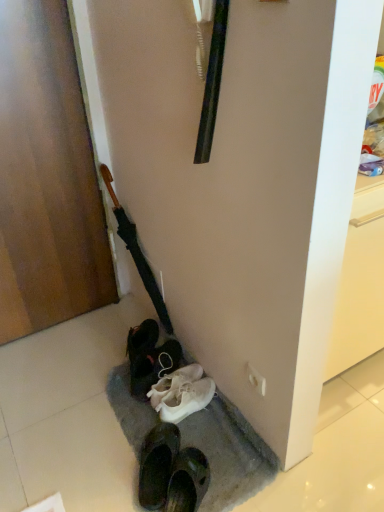
What do you see at coordinates (46, 177) in the screenshot? I see `wooden door at left` at bounding box center [46, 177].

Measure the distance between wooden door at left and camera.

wooden door at left is 4.58 feet away from camera.

The height and width of the screenshot is (512, 384). Identify the location of black matte umbrella at left. (136, 252).

Identify the location of umbrella behind the wooden door at left. Image resolution: width=384 pixels, height=512 pixels. (136, 252).

Is wooden door at left completely or partially outside of black matte umbrella at left?

Yes.

Who is smaller, wooden door at left or black matte umbrella at left?

black matte umbrella at left.

Can you confirm if black matte umbrella at left is positioned to the right of white matte sneakers at lower center?

In fact, black matte umbrella at left is to the left of white matte sneakers at lower center.

From a real-world perspective, between black matte umbrella at left and white matte sneakers at lower center, who is vertically higher?

In real-world perspective, black matte umbrella at left is above.

Can you tell me how much black matte umbrella at left and white matte sneakers at lower center differ in facing direction?

0.00229 degrees separate the facing orientations of black matte umbrella at left and white matte sneakers at lower center.

Considering the points (113, 195) and (166, 369), which point is behind, point (113, 195) or point (166, 369)?

The point (113, 195) is behind.

Based on the photo, considering the sizes of objects wooden door at left and white matte sneakers at lower center in the image provided, who is taller, wooden door at left or white matte sneakers at lower center?

wooden door at left.

Does point (16, 124) come in front of point (152, 358)?

Yes, it is in front of point (152, 358).

Are wooden door at left and white matte sneakers at lower center far apart?

Actually, wooden door at left and white matte sneakers at lower center are a little close together.

From the image's perspective, is wooden door at left on top of white matte sneakers at lower center?

Yes, from the image's perspective, wooden door at left is on top of white matte sneakers at lower center.

Is point (140, 274) farther from camera compared to point (45, 215)?

Yes, it is.

From a real-world perspective, between black matte umbrella at left and wooden door at left, who is vertically higher?

From a 3D spatial view, wooden door at left is above.

Is black matte umbrella at left touching wooden door at left?

No, black matte umbrella at left is not next to wooden door at left.

Between black matte umbrella at left and wooden door at left, which one appears on the left side from the viewer's perspective?

Positioned to the left is wooden door at left.

Which of these two, white matte sneakers at lower center or black matte umbrella at left, is wider?

white matte sneakers at lower center.

Is white matte sneakers at lower center inside the boundaries of black matte umbrella at left, or outside?

white matte sneakers at lower center is outside black matte umbrella at left.

Considering the relative sizes of white matte sneakers at lower center and black matte umbrella at left in the image provided, is white matte sneakers at lower center taller than black matte umbrella at left?

In fact, white matte sneakers at lower center may be shorter than black matte umbrella at left.

Is white matte sneakers at lower center positioned far away from black matte umbrella at left?

No, white matte sneakers at lower center is in close proximity to black matte umbrella at left.

The image size is (384, 512). What are the coordinates of `door on the left side of white matte sneakers at lower center` in the screenshot? It's located at (46, 177).

Considering the relative positions of white matte sneakers at lower center and wooden door at left in the image provided, is white matte sneakers at lower center in front of wooden door at left?

That is False.

Is white matte sneakers at lower center at the right side of wooden door at left?

Correct, you'll find white matte sneakers at lower center to the right of wooden door at left.

From the picture: Can wooden door at left be found inside white matte sneakers at lower center?

No, wooden door at left is not a part of white matte sneakers at lower center.

At what (x,y) coordinates should I click in order to perform the action: click on door above the black matte umbrella at left (from the image's perspective). Please return your answer as a coordinate pair (x, y). This screenshot has height=512, width=384. Looking at the image, I should click on (46, 177).

Locate an element on the screen. footwear lying below the black matte umbrella at left (from the image's perspective) is located at coordinates (150, 357).

From the image, which object appears to be nearer to black matte umbrella at left, white matte sneakers at lower center or wooden door at left?

Among the two, white matte sneakers at lower center is located nearer to black matte umbrella at left.

Looking at the image, which one is located closer to white matte sneakers at lower center, wooden door at left or black matte umbrella at left?

Based on the image, black matte umbrella at left appears to be nearer to white matte sneakers at lower center.

From the image, which object appears to be farther from wooden door at left, white matte sneakers at lower center or black matte umbrella at left?

white matte sneakers at lower center is positioned further to the anchor wooden door at left.

When comparing their distances from black matte umbrella at left, does wooden door at left or white matte sneakers at lower center seem closer?

white matte sneakers at lower center is closer to black matte umbrella at left.

Which object lies further to the anchor point wooden door at left, black matte umbrella at left or white matte sneakers at lower center?

Based on the image, white matte sneakers at lower center appears to be further to wooden door at left.

From the image, which object appears to be nearer to white matte sneakers at lower center, black matte umbrella at left or wooden door at left?

black matte umbrella at left is positioned closer to the anchor white matte sneakers at lower center.

You are a GUI agent. You are given a task and a screenshot of the screen. Output one action in this format:
    pyautogui.click(x=<x>, y=<y>)
    Task: Click on the umbrella between wooden door at left and white matte sneakers at lower center vertically
    
    Given the screenshot: What is the action you would take?
    pyautogui.click(x=136, y=252)